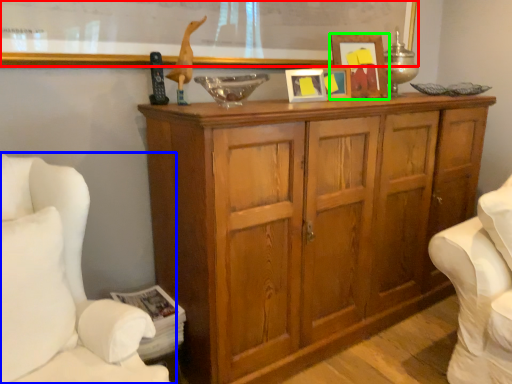
Question: Estimate the real-world distances between objects in this image. Which object is closer to bulletin board (highlighted by a red box), furniture (highlighted by a blue box) or picture frame (highlighted by a green box)?

Choices:
 (A) furniture
 (B) picture frame

Answer: (B)